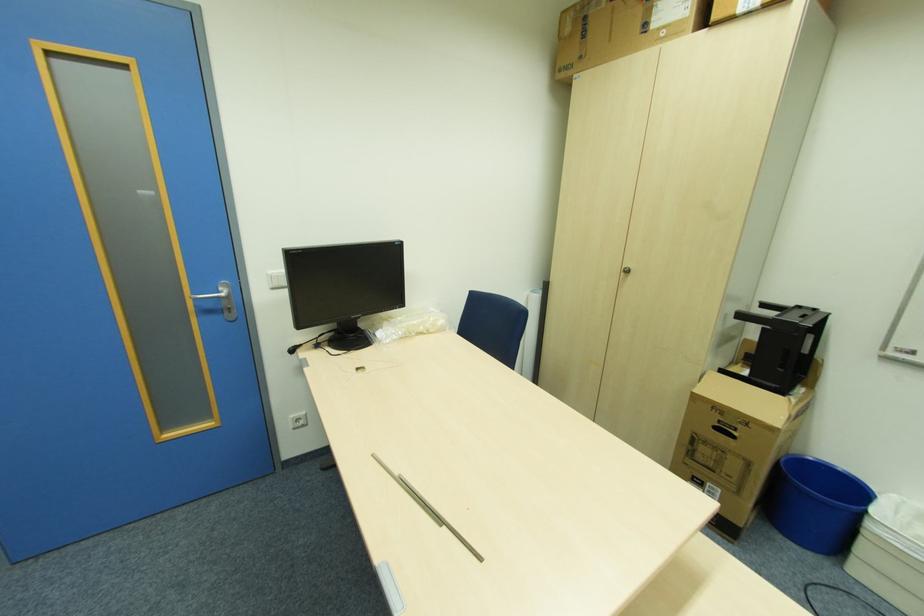
Find where to lift the black monitor stand. Please return your answer as a coordinate pair (x, y).

(348, 336)